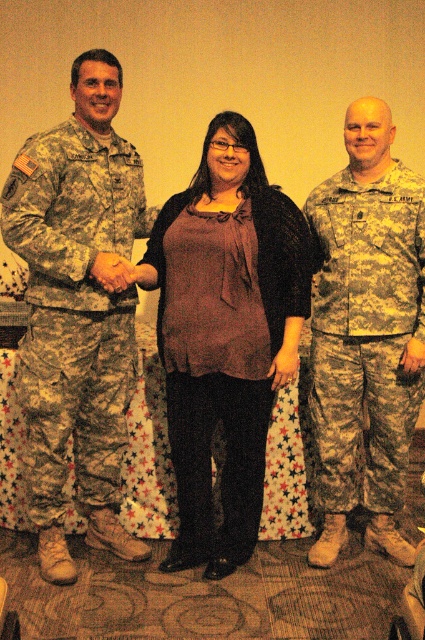
Can you confirm if matte brown blouse at center is wider than camouflage uniform at center?

Yes, matte brown blouse at center is wider than camouflage uniform at center.

Is matte brown blouse at center below camouflage uniform at center?

Yes, matte brown blouse at center is below camouflage uniform at center.

Image resolution: width=425 pixels, height=640 pixels. Describe the element at coordinates (224, 333) in the screenshot. I see `matte brown blouse at center` at that location.

Find the location of `matte brown blouse at center`. matte brown blouse at center is located at coordinates (224, 333).

Is point (112, 477) closer to viewer compared to point (328, 403)?

No, it is behind (328, 403).

Which is in front, point (112, 424) or point (363, 234)?

Point (363, 234) is in front.

Identify the location of camouflage uniform at left. (78, 308).

Is point (124, 220) farther from camera compared to point (255, 444)?

Yes.

Consider the image. Which is below, camouflage uniform at left or matte brown blouse at center?

matte brown blouse at center

Is point (90, 81) less distant than point (269, 280)?

Yes, it is in front of point (269, 280).

At what (x,y) coordinates should I click in order to perform the action: click on camouflage uniform at left. Please return your answer as a coordinate pair (x, y). Looking at the image, I should click on (78, 308).